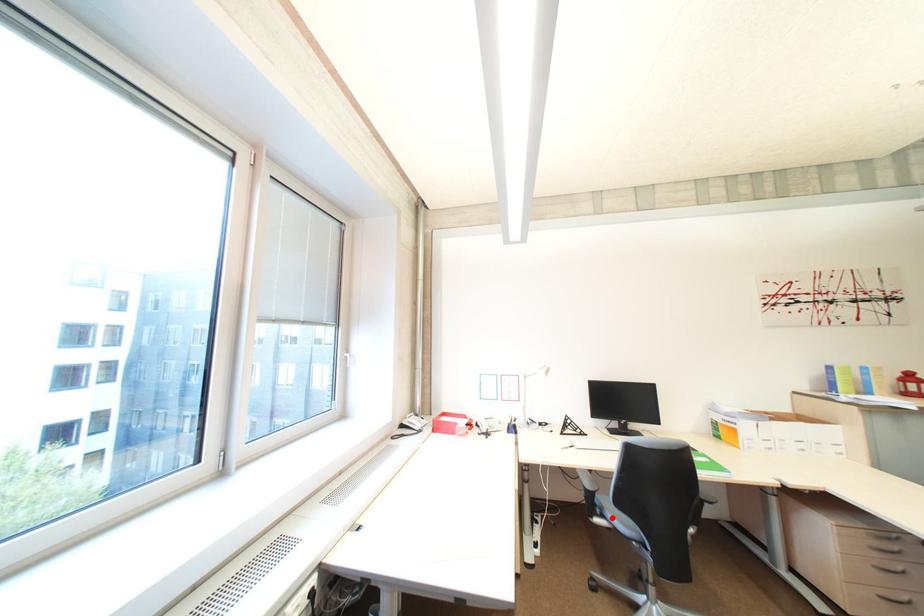
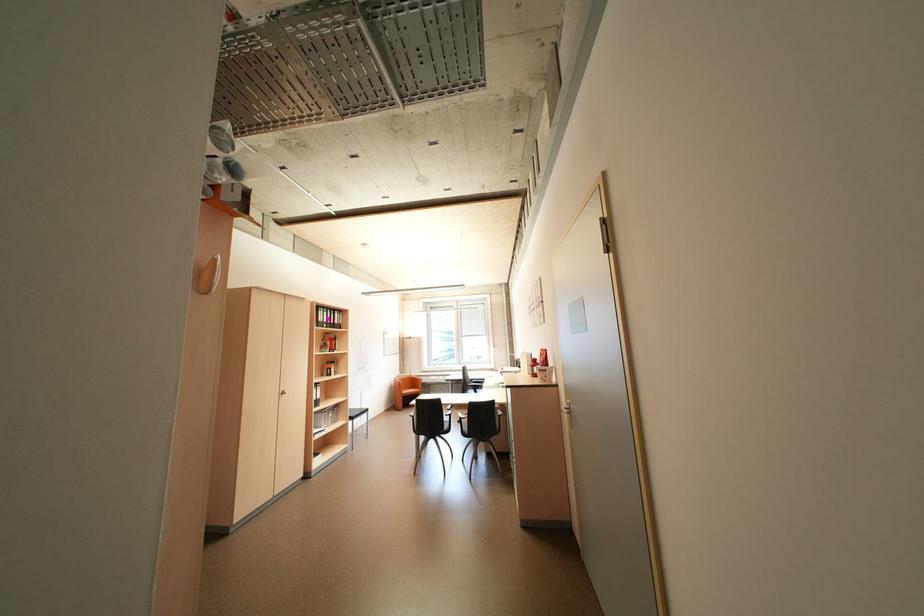
Question: I am providing you with two images of the same scene from different viewpoints. A red point is marked on the first image. At the location where the point appears in image 1, is it still visible in image 2?

Choices:
 (A) Yes
 (B) No

Answer: (B)